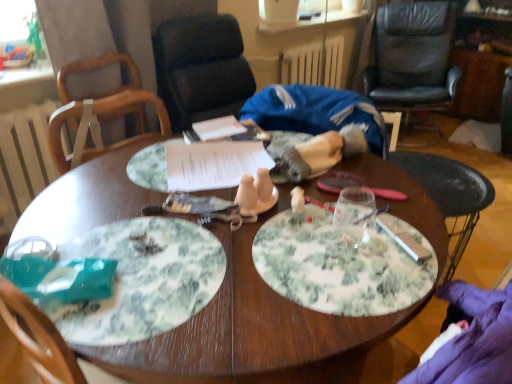
Where is `blank area to the left of floral paper plate at center, arranged as the first plate when viewed from the back`? This screenshot has height=384, width=512. blank area to the left of floral paper plate at center, arranged as the first plate when viewed from the back is located at coordinates (109, 187).